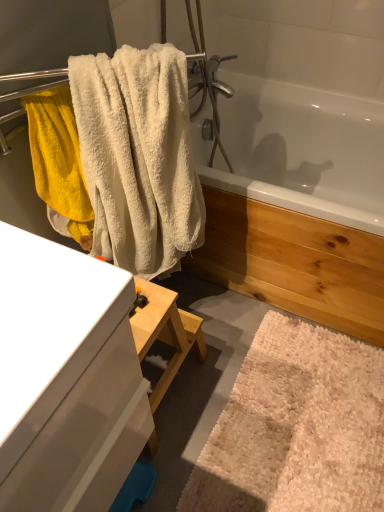
Question: Considering the positions of white fluffy towel at upper left and white fluffy bath mat at lower right in the image, is white fluffy towel at upper left bigger or smaller than white fluffy bath mat at lower right?

Choices:
 (A) small
 (B) big

Answer: (B)

Question: From a real-world perspective, is white fluffy towel at upper left physically located above or below white fluffy bath mat at lower right?

Choices:
 (A) above
 (B) below

Answer: (A)

Question: Estimate the real-world distances between objects in this image. Which object is closer to the white glossy cabinet at left?

Choices:
 (A) white fluffy towel at upper left
 (B) white fluffy bath mat at lower right
 (C) white glossy bathtub at upper center

Answer: (A)

Question: Which object is positioned closest to the white fluffy towel at upper left?

Choices:
 (A) white glossy cabinet at left
 (B) white glossy bathtub at upper center
 (C) white fluffy bath mat at lower right

Answer: (A)